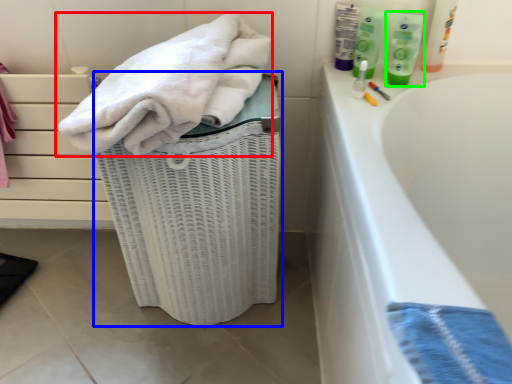
Question: Estimate the real-world distances between objects in this image. Which object is closer to towel (highlighted by a red box), laundry basket (highlighted by a blue box) or toiletry (highlighted by a green box)?

Choices:
 (A) laundry basket
 (B) toiletry

Answer: (A)